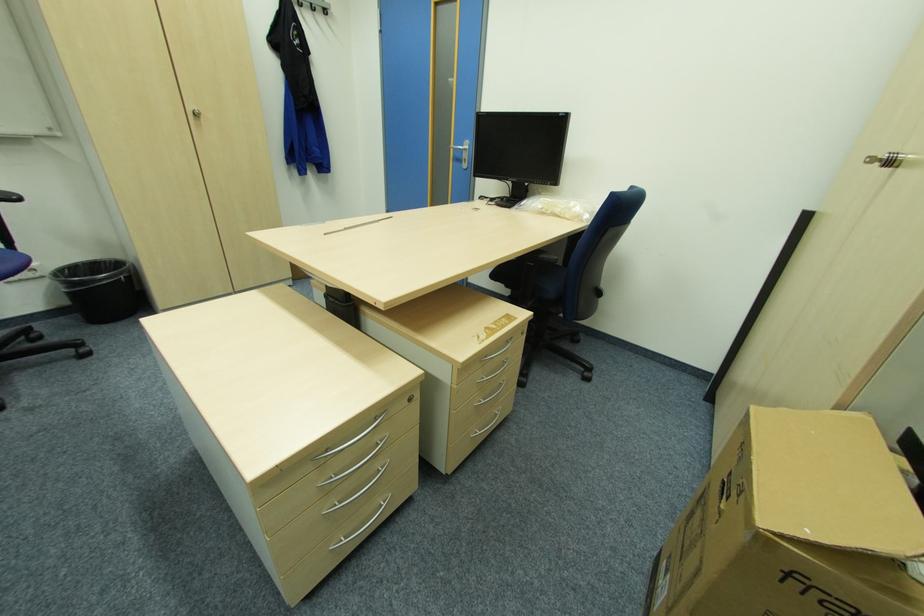
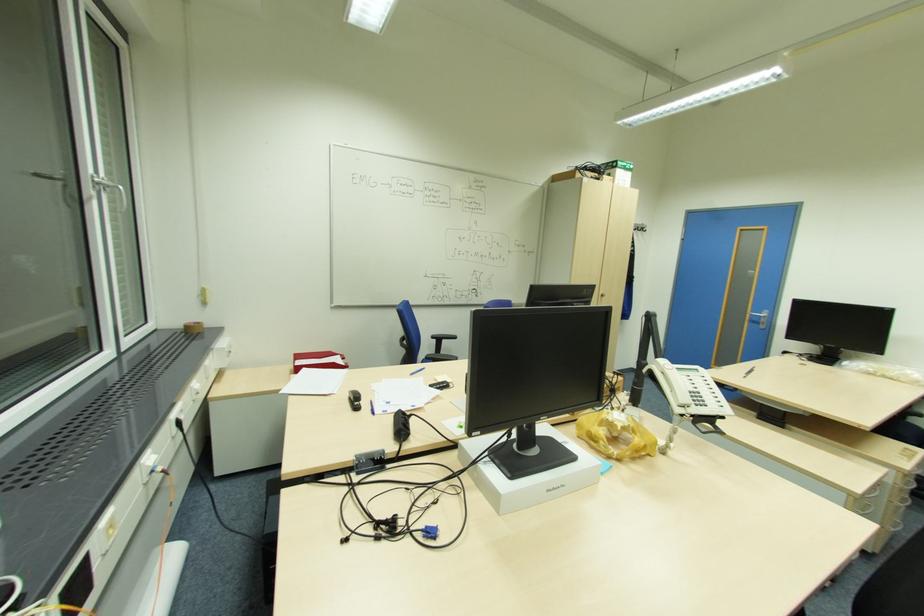
Locate, in the second image, the point that corresponds to point (468, 159) in the first image.

(766, 323)